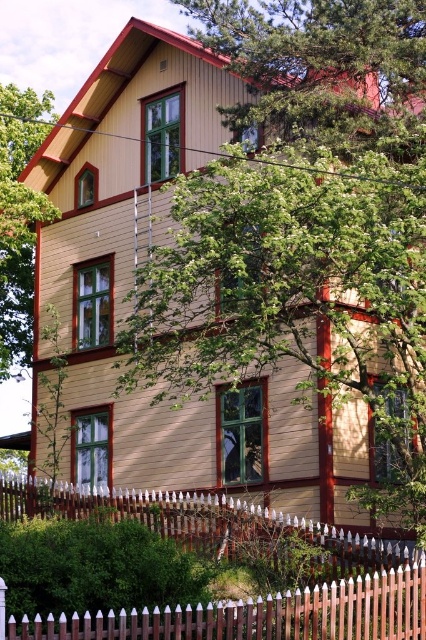
You are standing in front of the residential building and want to enter the garden. Based on the location of the brown wooden fence at lower center, where should you look for the entrance?

The entrance is likely near the brown wooden fence at lower center, as it is positioned at point coordinates indicating it might be the boundary or entry point to the garden.

You are standing in front of the residential building and notice a point marked at coordinates (322,65). Based on the scene description, can you identify which object this point corresponds to?

The point at coordinates (322,65) corresponds to the green leafy tree at upper center.

You are standing in front of the house and want to walk towards the brown wooden fence at lower center. Which direction should you move relative to the green leafy tree at left?

The brown wooden fence at lower center is to the right of the green leafy tree at left, so you should move to the right of the green leafy tree at left to reach the brown wooden fence at lower center.